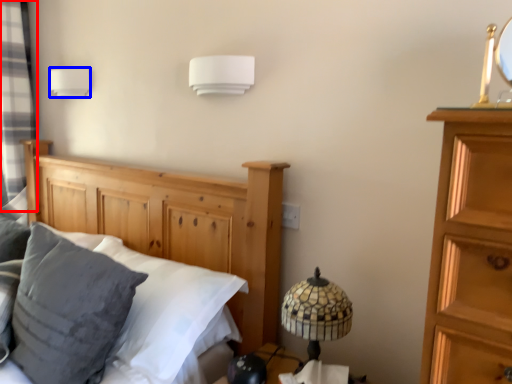
Question: Which object appears farthest to the camera in this image, curtain (highlighted by a red box) or lamp (highlighted by a blue box)?

Choices:
 (A) curtain
 (B) lamp

Answer: (A)